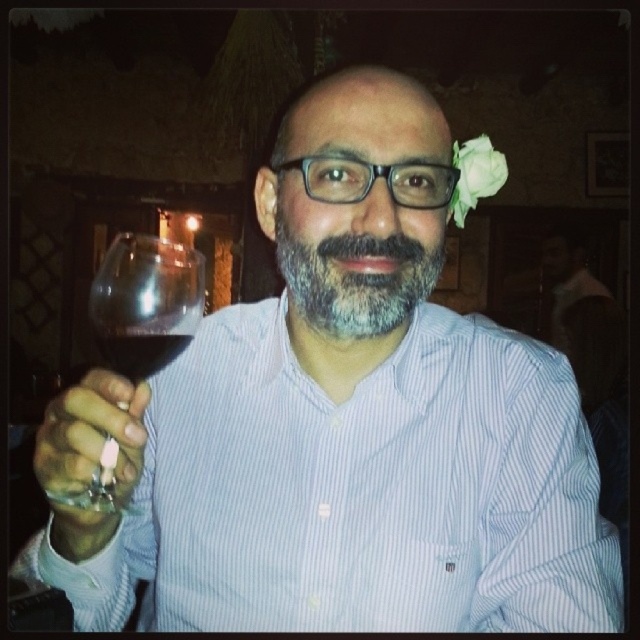
You are a bartender preparing drinks. You see the transparent glass at upper left and the dark red glass at center. Which glass is positioned higher up in the image?

The transparent glass at upper left is positioned higher up in the image than the dark red glass at center.

You are a bartender who needs to choose between the transparent glass at upper left and the dark red glass at center for serving a new cocktail. Based on their sizes, which glass would be more suitable if you want to serve a drink with a larger volume?

The transparent glass at upper left might be wider than dark red glass at center, so it could hold a larger volume of liquid, making it more suitable for serving the new cocktail.

You are a photographer standing in the scene. You want to take a photo of the dark red glass at center and the white paper flower at upper right. The minimum distance your camera can focus on two objects is 50 centimeters. Will you be able to capture both in focus?

The distance between the white paper flower at upper right and dark red glass at center is 42.21 centimeters, which is less than the minimum focus distance of 50 centimeters. Therefore, you cannot capture both in focus.